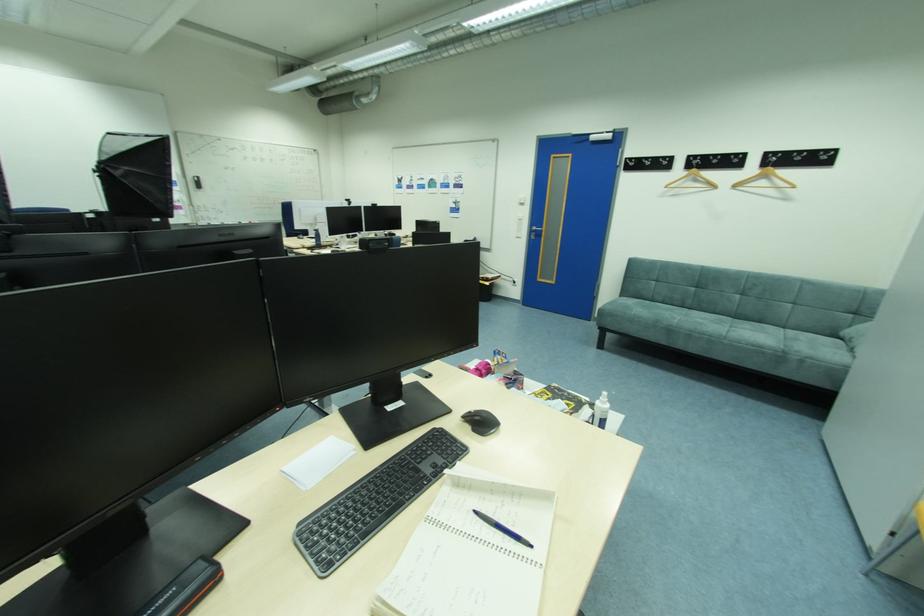
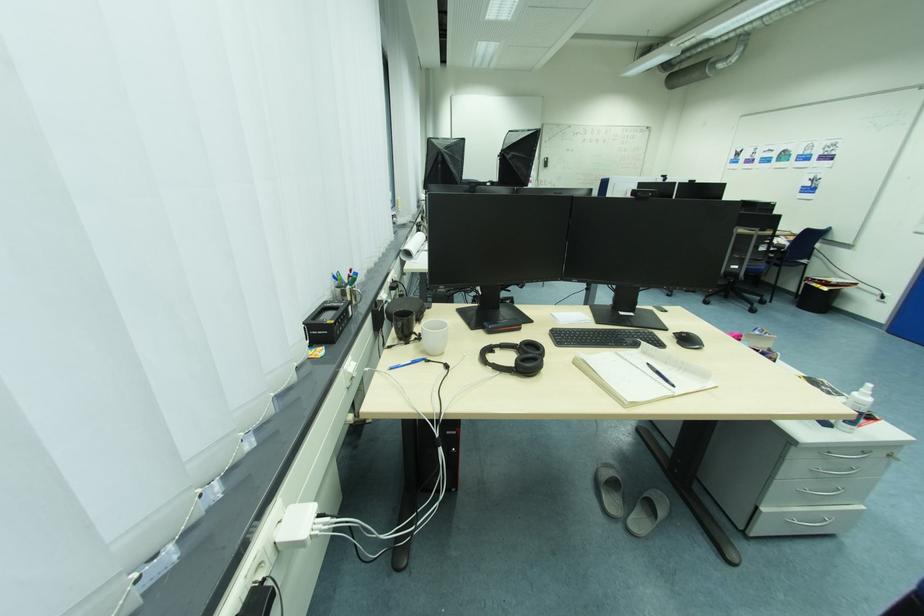
Where in the second image is the point corresponding to (475,428) from the first image?

(682, 341)